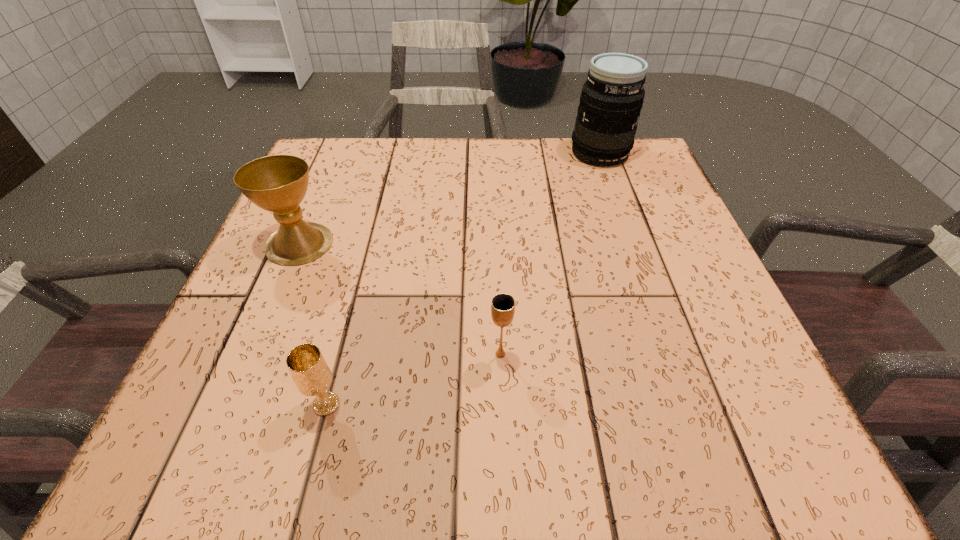
Identify the location of free space between the third object from left to right and the rightmost object. This screenshot has width=960, height=540. (550, 253).

This screenshot has width=960, height=540. Identify the location of vacant space in between the rightmost object and the rightmost chalice. (550, 253).

Where is `unoccupied position between the second object from left to right and the tallest chalice`? This screenshot has width=960, height=540. unoccupied position between the second object from left to right and the tallest chalice is located at coordinates (313, 323).

I want to click on vacant area that lies between the nearest object and the tallest object, so click(463, 278).

Locate an element on the screen. The width and height of the screenshot is (960, 540). free point between the farthest chalice and the third farthest object is located at coordinates (399, 299).

Identify the location of object that is the second closest one to the second chalice from right to left. (278, 183).

This screenshot has height=540, width=960. Find the location of `object that is the third closest to the leftmost chalice`. object that is the third closest to the leftmost chalice is located at coordinates (612, 97).

Identify the location of chalice object that ranks as the second closest to the second farthest chalice. The image size is (960, 540). (278, 183).

In order to click on chalice that is the third nearest to the rightmost object in this screenshot , I will do `click(308, 368)`.

Identify the location of vacant space that satisfies the following two spatial constraints: 1. on the front side of the third shortest object; 2. on the right side of the nearest chalice. The width and height of the screenshot is (960, 540). click(x=230, y=404).